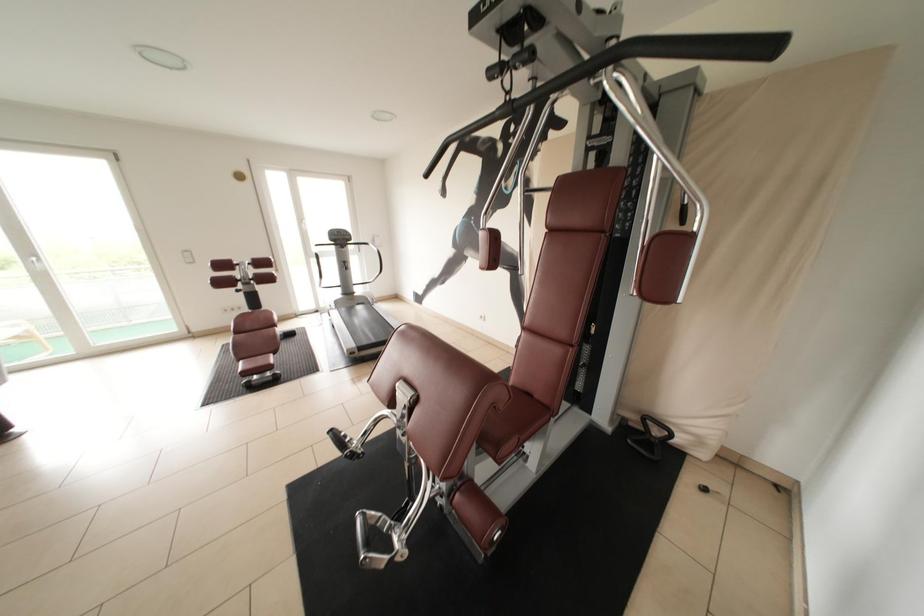
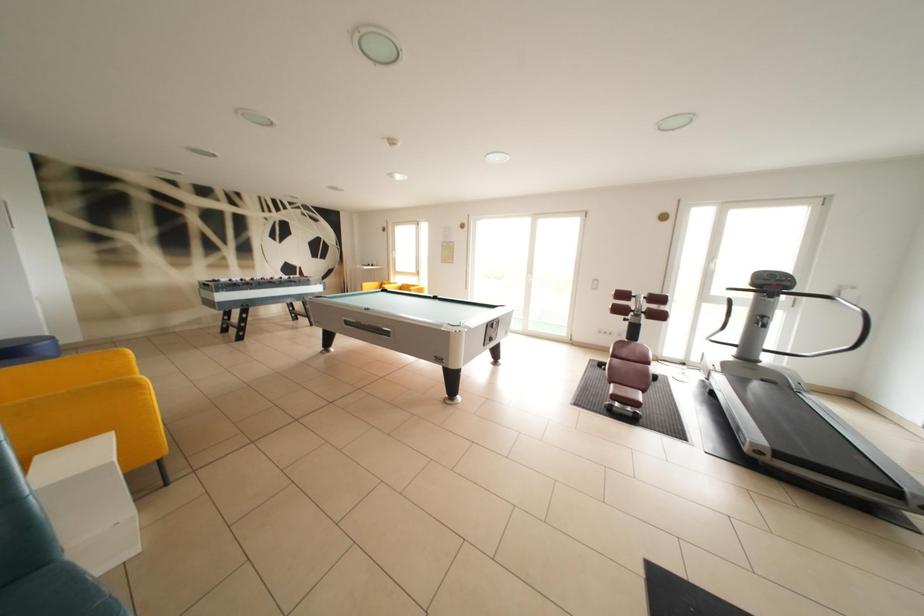
Question: The first image is from the beginning of the video and the second image is from the end. How did the camera likely rotate when shooting the video?

Choices:
 (A) Left
 (B) Right
 (C) Up
 (D) Down

Answer: (A)